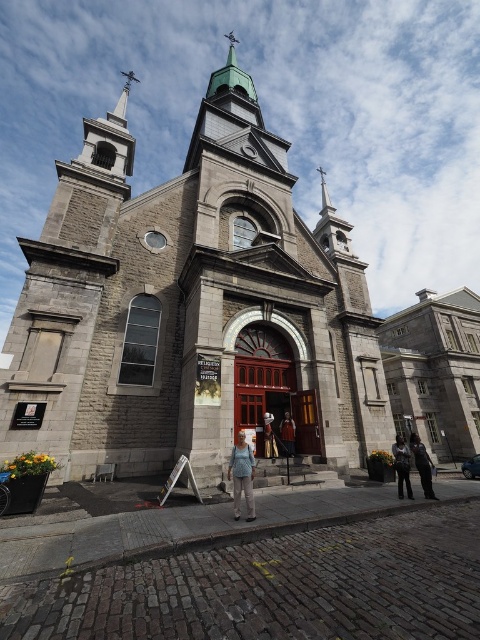
Question: Does gray stone church at center lie in front of light blue denim jeans at center?

Choices:
 (A) no
 (B) yes

Answer: (A)

Question: Which object appears closest to the camera in this image?

Choices:
 (A) light blue denim jeans at center
 (B) denim jacket at center
 (C) gray stone church at center

Answer: (A)

Question: Which of the following is the farthest from the observer?

Choices:
 (A) (120, 99)
 (B) (218, 150)

Answer: (A)

Question: Among these points, which one is farthest from the camera?

Choices:
 (A) (264, 413)
 (B) (433, 493)
 (C) (289, 451)
 (D) (126, 92)

Answer: (D)

Question: Is polished silver spire at upper left further to camera compared to denim pants at center?

Choices:
 (A) no
 (B) yes

Answer: (B)

Question: Does denim pants at lower right have a smaller size compared to denim pants at center?

Choices:
 (A) yes
 (B) no

Answer: (A)